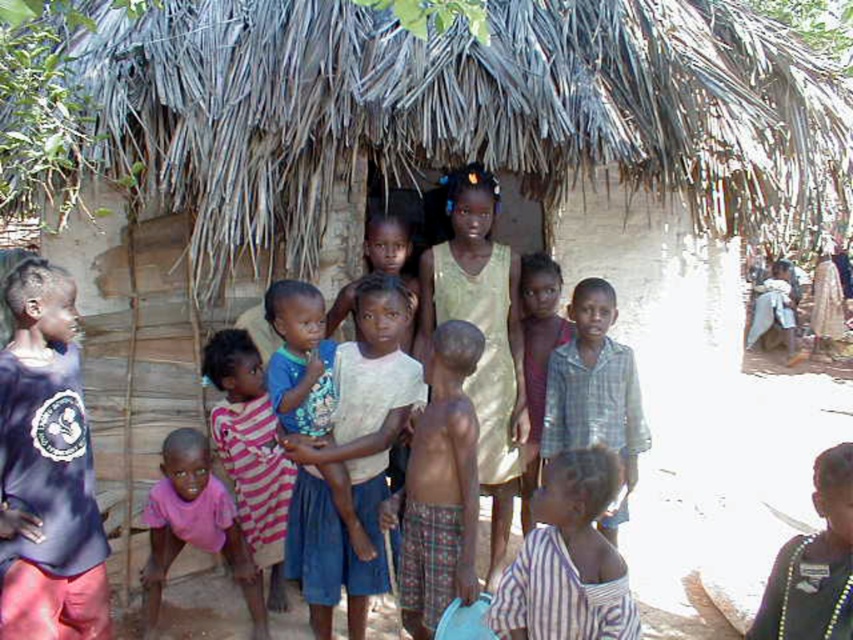
Question: Which object is positioned farthest from the striped fabric at lower right?

Choices:
 (A) dark brown necklace at lower right
 (B) skinny fabric shirt at center
 (C) blue denim shorts at center

Answer: (C)

Question: Can you confirm if skinny fabric shirt at center is wider than blue denim shorts at center?

Choices:
 (A) yes
 (B) no

Answer: (B)

Question: Does plaid fabric shirt at center appear on the right side of blue denim shorts at center?

Choices:
 (A) no
 (B) yes

Answer: (B)

Question: Does blue denim shorts at center appear on the right side of striped fabric shirt at center?

Choices:
 (A) yes
 (B) no

Answer: (B)

Question: Which point is closer to the camera?

Choices:
 (A) dark brown necklace at lower right
 (B) pink striped shirt at center
 (C) pink fabric shirt at lower left

Answer: (A)

Question: Which point is farther from the camera taking this photo?

Choices:
 (A) (456, 420)
 (B) (151, 566)
 (C) (279, 460)

Answer: (C)